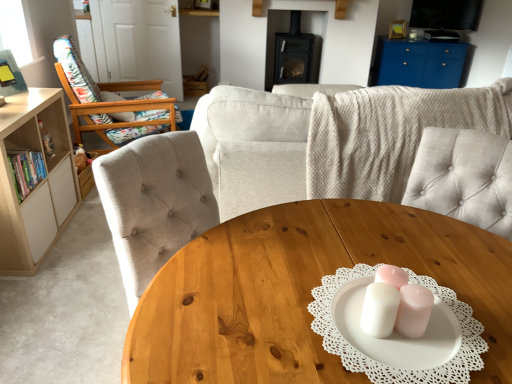
Where is `vacant space situated above wooden coffee table at center (from a real-world perspective)`? vacant space situated above wooden coffee table at center (from a real-world perspective) is located at coordinates (362, 267).